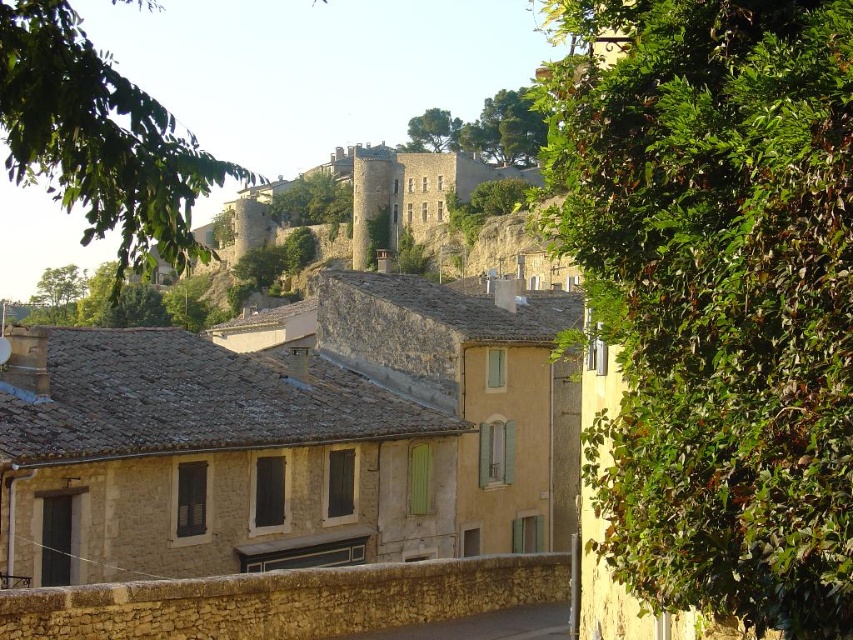
Question: Can you confirm if stone house at center is positioned to the left of gray stone alley at lower center?

Choices:
 (A) no
 (B) yes

Answer: (B)

Question: Which point appears farthest from the camera in this image?

Choices:
 (A) (549, 616)
 (B) (341, 426)

Answer: (B)

Question: Can you confirm if stone house at center is positioned above gray stone alley at lower center?

Choices:
 (A) yes
 (B) no

Answer: (A)

Question: Among these objects, which one is farthest from the camera?

Choices:
 (A) stone house at center
 (B) gray stone alley at lower center

Answer: (B)

Question: Can you confirm if stone house at center is positioned to the left of gray stone alley at lower center?

Choices:
 (A) no
 (B) yes

Answer: (B)